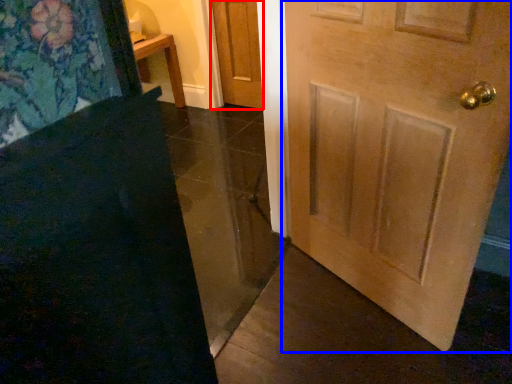
Question: Which object is further to the camera taking this photo, door (highlighted by a red box) or door (highlighted by a blue box)?

Choices:
 (A) door
 (B) door

Answer: (A)